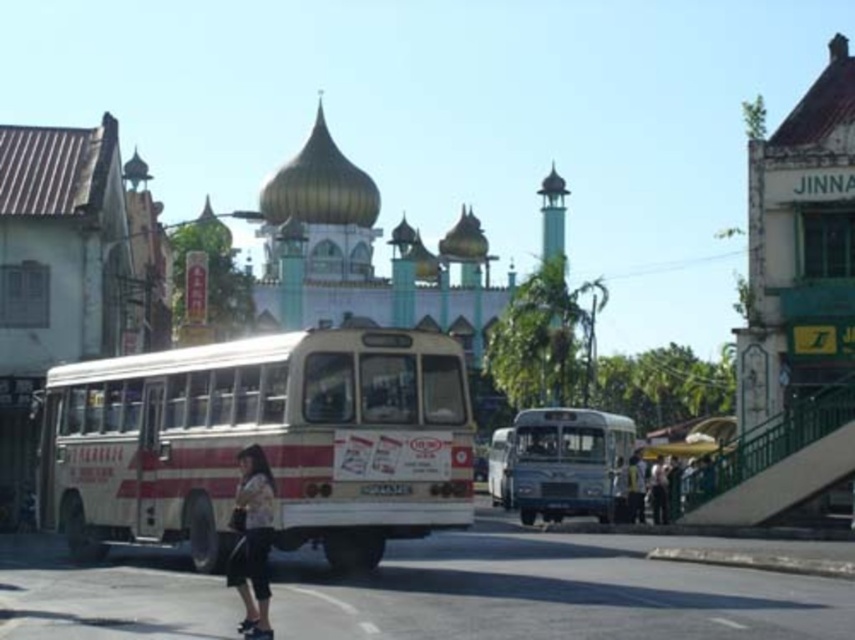
Question: Is white painted metal bus at center smaller than light beige fabric pants at lower left?

Choices:
 (A) yes
 (B) no

Answer: (B)

Question: Considering the relative positions of white painted metal bus at center and light brown leather jacket at lower right in the image provided, where is white painted metal bus at center located with respect to light brown leather jacket at lower right?

Choices:
 (A) right
 (B) left

Answer: (B)

Question: Estimate the real-world distances between objects in this image. Which object is closer to the white matte bus at center?

Choices:
 (A) dark gray fabric jacket at lower right
 (B) white painted metal bus at center
 (C) light brown leather jacket at lower right

Answer: (C)

Question: Which of the following is the farthest from the observer?

Choices:
 (A) metallic silver bus at center
 (B) dark gray fabric jacket at lower right
 (C) white painted metal bus at center
 (D) white matte bus at center

Answer: (D)

Question: Is white matte bus at center bigger than dark gray fabric jacket at lower right?

Choices:
 (A) yes
 (B) no

Answer: (A)

Question: Among these points, which one is nearest to the camera?

Choices:
 (A) (243, 627)
 (B) (506, 456)
 (C) (202, 532)
 (D) (629, 486)

Answer: (A)